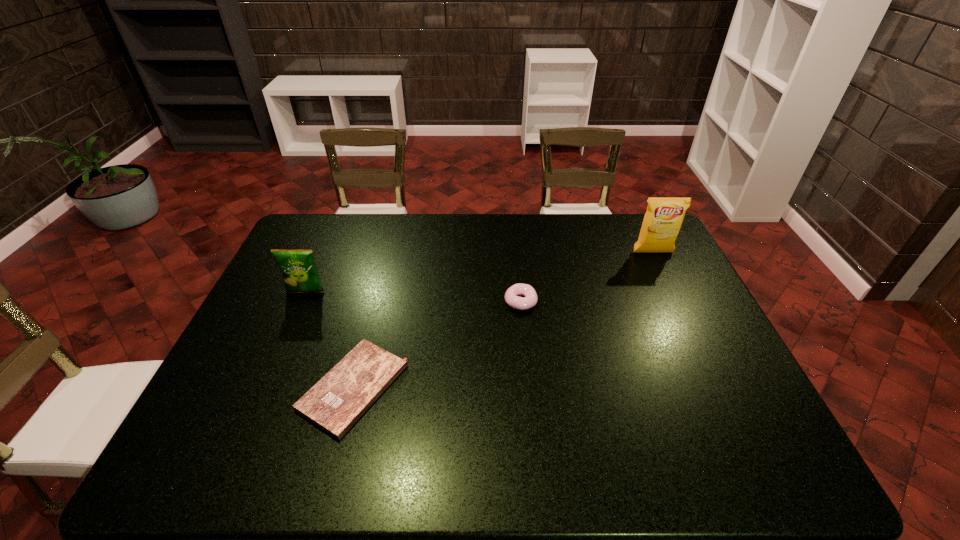
Where is `free spot between the left crisp (potato chip) and the third tallest object`? free spot between the left crisp (potato chip) and the third tallest object is located at coordinates tap(414, 297).

This screenshot has width=960, height=540. Find the location of `free space between the tallest object and the doughnut`. free space between the tallest object and the doughnut is located at coordinates (587, 277).

Locate an element on the screen. free spot between the third object from right to left and the second shortest object is located at coordinates (437, 345).

At what (x,y) coordinates should I click in order to perform the action: click on blank region between the third object from right to left and the left crisp (potato chip). Please return your answer as a coordinate pair (x, y). This screenshot has width=960, height=540. Looking at the image, I should click on (329, 340).

You are a GUI agent. You are given a task and a screenshot of the screen. Output one action in this format:
    pyautogui.click(x=<x>, y=<y>)
    Task: Click on the object that can be found as the third closest to the Bible
    
    Given the screenshot: What is the action you would take?
    pyautogui.click(x=664, y=216)

Choose which object is the second nearest neighbor to the farther crisp (potato chip). Please provide its 2D coordinates. Your answer should be formatted as a tuple, i.e. [(x, y)], where the tuple contains the x and y coordinates of a point satisfying the conditions above.

[(335, 403)]

Image resolution: width=960 pixels, height=540 pixels. Identify the location of free region that satisfies the following two spatial constraints: 1. on the front-facing side of the doughnut; 2. on the right side of the left crisp (potato chip). (301, 302).

What are the coordinates of `vacant space that satisfies the following two spatial constraints: 1. on the front-facing side of the shorter crisp (potato chip); 2. on the right side of the doughnut` in the screenshot? It's located at (301, 302).

This screenshot has width=960, height=540. I want to click on vacant position in the image that satisfies the following two spatial constraints: 1. on the front-facing side of the left crisp (potato chip); 2. on the right side of the doughnut, so click(301, 302).